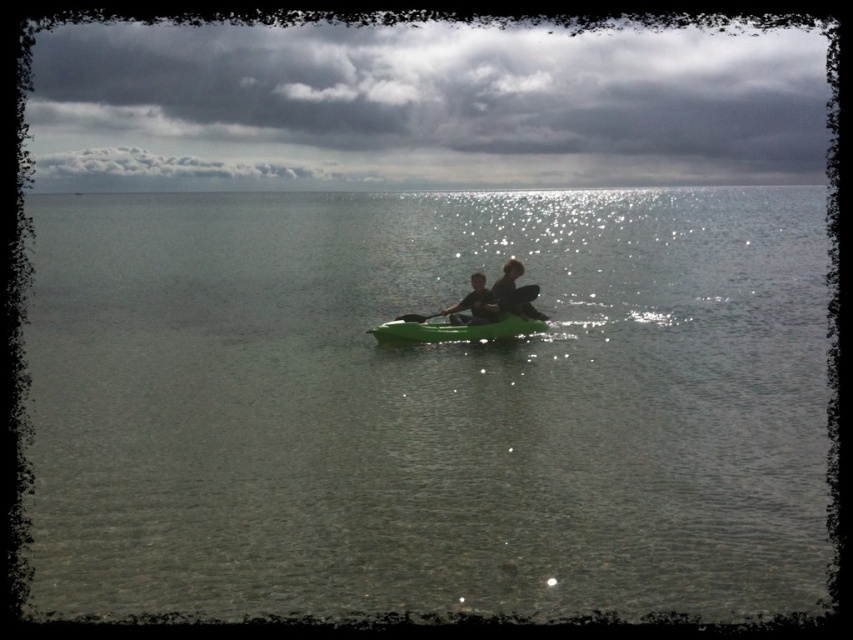
Does clear water at center appear over green plastic canoe at center?

Yes.

The height and width of the screenshot is (640, 853). Find the location of `clear water at center`. clear water at center is located at coordinates (428, 403).

Locate an element on the screen. clear water at center is located at coordinates (428, 403).

What do you see at coordinates (428, 403) in the screenshot? I see `clear water at center` at bounding box center [428, 403].

Is point (80, 556) positioned behind point (521, 285)?

No, it is not.

The height and width of the screenshot is (640, 853). What do you see at coordinates (428, 403) in the screenshot? I see `clear water at center` at bounding box center [428, 403].

Where is `clear water at center`? The image size is (853, 640). clear water at center is located at coordinates (428, 403).

Does matte green kayak at center appear on the left side of green plastic paddle at center?

Incorrect, matte green kayak at center is not on the left side of green plastic paddle at center.

Can you confirm if matte green kayak at center is shorter than green plastic paddle at center?

In fact, matte green kayak at center may be taller than green plastic paddle at center.

Identify the location of matte green kayak at center. (476, 301).

Identify the location of matte green kayak at center. This screenshot has width=853, height=640. (476, 301).